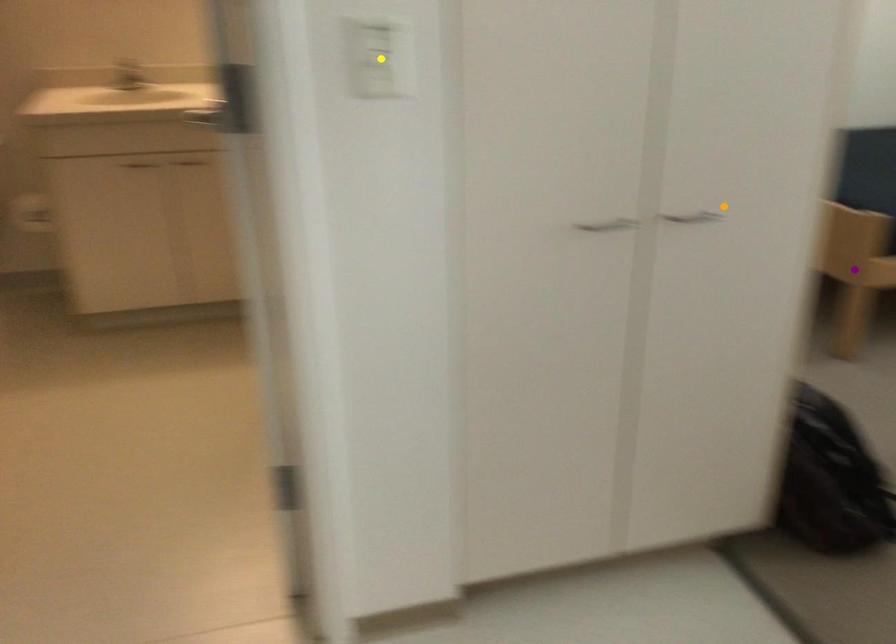
Order these from farthest to nearest:
orange point | purple point | yellow point

purple point < orange point < yellow point